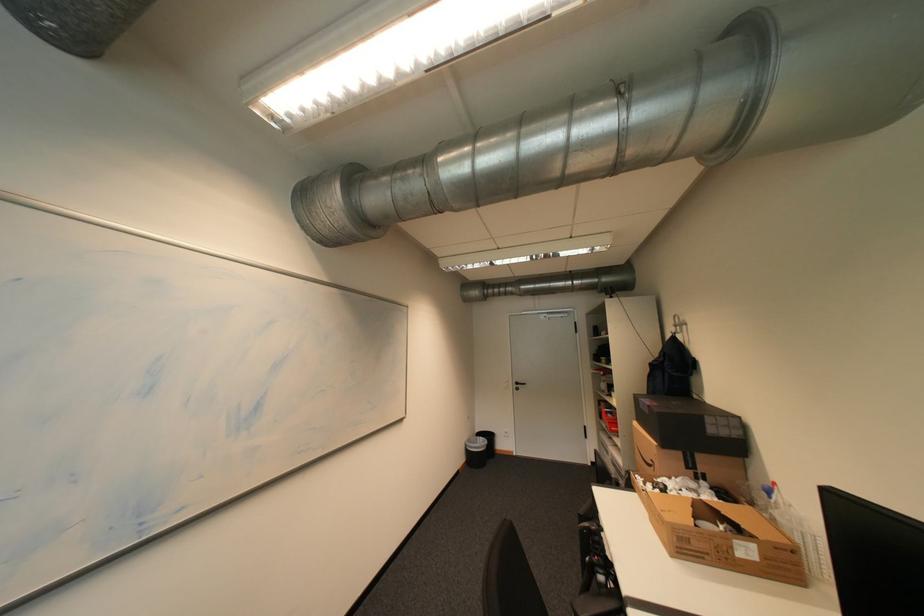
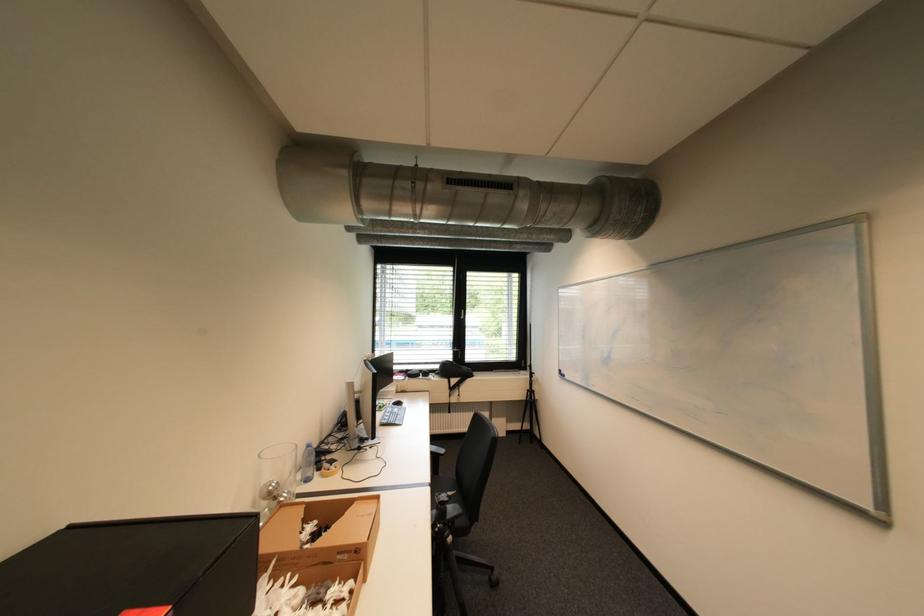
Find the pixel in the second image that matches point 748,525 in the first image.

(311, 520)